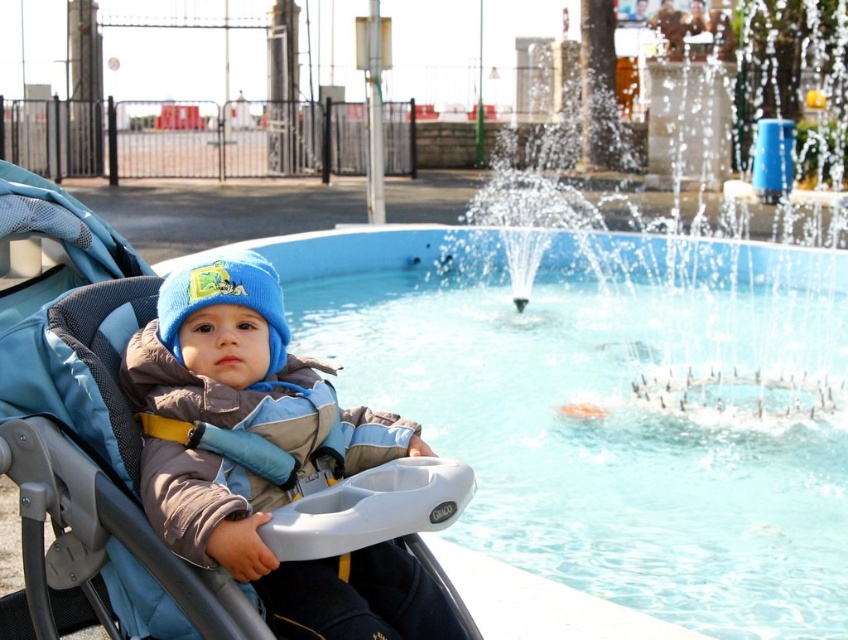
Does blue fabric baby carriage at left come in front of knitted blue beanie at center?

Yes.

What do you see at coordinates (219, 424) in the screenshot?
I see `blue fabric baby carriage at left` at bounding box center [219, 424].

The height and width of the screenshot is (640, 848). I want to click on blue fabric baby carriage at left, so click(219, 424).

In the scene shown: Does clear blue water at center appear under knitted blue beanie at center?

Correct, clear blue water at center is located below knitted blue beanie at center.

Is clear blue water at center positioned at the back of knitted blue beanie at center?

That is True.

I want to click on clear blue water at center, so click(604, 404).

Can you confirm if clear blue water at center is wider than blue fabric baby carriage at left?

Correct, the width of clear blue water at center exceeds that of blue fabric baby carriage at left.

Is clear blue water at center positioned before blue fabric baby carriage at left?

No, clear blue water at center is further to the viewer.

The width and height of the screenshot is (848, 640). What do you see at coordinates (604, 404) in the screenshot? I see `clear blue water at center` at bounding box center [604, 404].

The image size is (848, 640). I want to click on clear blue water at center, so click(x=604, y=404).